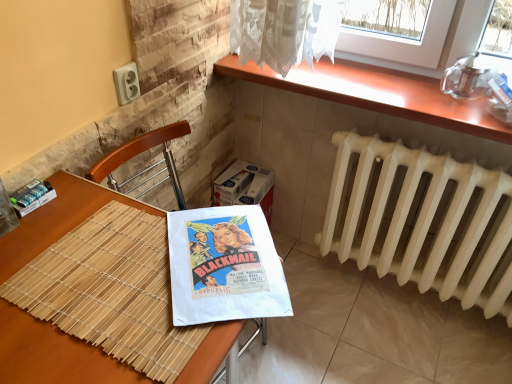
Question: Is white cardboard box at center positioned in front of wooden table at lower left?

Choices:
 (A) no
 (B) yes

Answer: (A)

Question: Is the surface of white cardboard box at center in direct contact with wooden table at lower left?

Choices:
 (A) yes
 (B) no

Answer: (B)

Question: Does white cardboard box at center have a greater width compared to wooden table at lower left?

Choices:
 (A) no
 (B) yes

Answer: (A)

Question: Does white cardboard box at center have a lesser height compared to wooden table at lower left?

Choices:
 (A) no
 (B) yes

Answer: (B)

Question: Is white cardboard box at center looking in the opposite direction of wooden table at lower left?

Choices:
 (A) no
 (B) yes

Answer: (A)

Question: Could you tell me if white cardboard box at center is turned towards wooden table at lower left?

Choices:
 (A) no
 (B) yes

Answer: (A)

Question: Is wooden table at lower left positioned beyond the bounds of white cardboard box at center?

Choices:
 (A) no
 (B) yes

Answer: (B)

Question: Can you confirm if wooden table at lower left is smaller than white cardboard box at center?

Choices:
 (A) yes
 (B) no

Answer: (B)

Question: Is white cardboard box at center surrounded by wooden table at lower left?

Choices:
 (A) no
 (B) yes

Answer: (A)

Question: Considering the relative positions of wooden table at lower left and white cardboard box at center in the image provided, is wooden table at lower left behind white cardboard box at center?

Choices:
 (A) no
 (B) yes

Answer: (A)

Question: Is wooden table at lower left to the left of white cardboard box at center from the viewer's perspective?

Choices:
 (A) no
 (B) yes

Answer: (B)

Question: Is wooden table at lower left turned away from white cardboard box at center?

Choices:
 (A) yes
 (B) no

Answer: (B)

Question: Considering the relative sizes of white cardboard box at center and wooden at upper right in the image provided, is white cardboard box at center bigger than wooden at upper right?

Choices:
 (A) yes
 (B) no

Answer: (A)